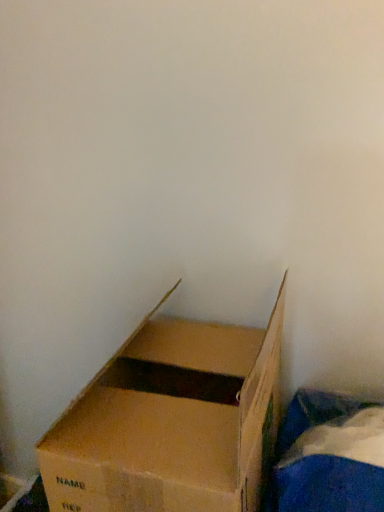
What do you see at coordinates (171, 421) in the screenshot? I see `brown cardboard box at lower right` at bounding box center [171, 421].

Where is `brown cardboard box at lower right`? The height and width of the screenshot is (512, 384). brown cardboard box at lower right is located at coordinates (171, 421).

In order to click on brown cardboard box at lower right in this screenshot , I will do `click(171, 421)`.